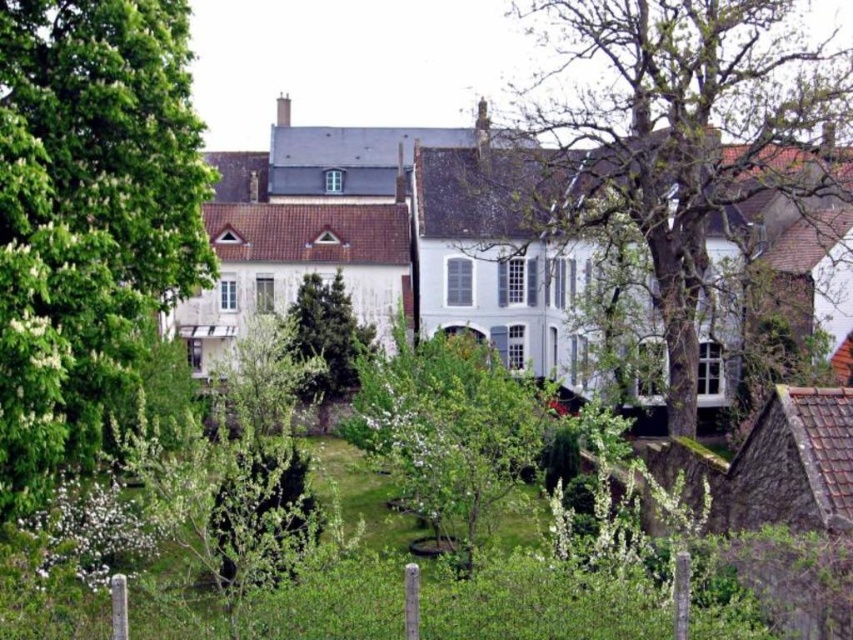
Can you confirm if smooth bark tree at center is wider than green textured tree at center?

Yes, smooth bark tree at center is wider than green textured tree at center.

Based on the photo, who is more forward, (799, 36) or (335, 282)?

Positioned in front is point (799, 36).

This screenshot has height=640, width=853. Describe the element at coordinates (679, 132) in the screenshot. I see `smooth bark tree at center` at that location.

This screenshot has height=640, width=853. In order to click on smooth bark tree at center in this screenshot , I will do `click(679, 132)`.

Can you confirm if green leafy tree at left is shorter than green textured tree at center?

Incorrect, green leafy tree at left's height does not fall short of green textured tree at center's.

Does green leafy tree at left have a larger size compared to green textured tree at center?

Correct, green leafy tree at left is larger in size than green textured tree at center.

Between point (90, 81) and point (351, 381), which one is positioned in front?

Point (90, 81) is more forward.

Locate an element on the screen. Image resolution: width=853 pixels, height=640 pixels. green leafy tree at left is located at coordinates (x=88, y=216).

Does green leafy tree at center have a greater width compared to green textured tree at center?

Indeed, green leafy tree at center has a greater width compared to green textured tree at center.

Does point (479, 429) come behind point (349, 317)?

No, it is in front of (349, 317).

Is point (451, 493) closer to viewer compared to point (294, 324)?

Yes, it is in front of point (294, 324).

Locate an element on the screen. The width and height of the screenshot is (853, 640). green leafy tree at center is located at coordinates (448, 429).